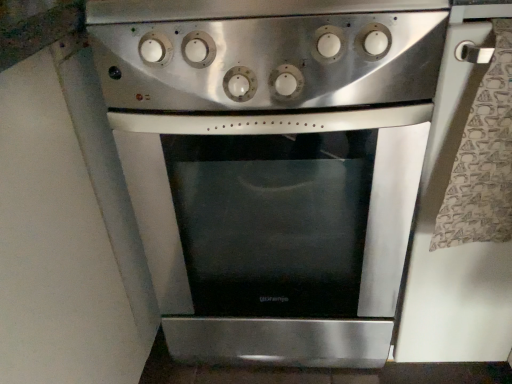
Question: From the image's perspective, is stainless steel oven at center beneath stainless steel oven at center?

Choices:
 (A) no
 (B) yes

Answer: (B)

Question: Is stainless steel oven at center far away from stainless steel oven at center?

Choices:
 (A) yes
 (B) no

Answer: (B)

Question: Is stainless steel oven at center not inside stainless steel oven at center?

Choices:
 (A) no
 (B) yes

Answer: (B)

Question: Does stainless steel oven at center have a larger size compared to stainless steel oven at center?

Choices:
 (A) no
 (B) yes

Answer: (B)

Question: Is stainless steel oven at center smaller than stainless steel oven at center?

Choices:
 (A) no
 (B) yes

Answer: (A)

Question: From the image's perspective, is stainless steel oven at center above stainless steel oven at center?

Choices:
 (A) yes
 (B) no

Answer: (B)

Question: From a real-world perspective, does stainless steel oven at center sit lower than stainless steel oven at center?

Choices:
 (A) yes
 (B) no

Answer: (B)

Question: Is the surface of stainless steel oven at center in direct contact with stainless steel oven at center?

Choices:
 (A) yes
 (B) no

Answer: (B)

Question: Is stainless steel oven at center to the right of stainless steel oven at center from the viewer's perspective?

Choices:
 (A) no
 (B) yes

Answer: (A)

Question: Can you confirm if stainless steel oven at center is shorter than stainless steel oven at center?

Choices:
 (A) no
 (B) yes

Answer: (B)

Question: Is stainless steel oven at center positioned far away from stainless steel oven at center?

Choices:
 (A) yes
 (B) no

Answer: (B)

Question: From the image's perspective, is stainless steel oven at center on stainless steel oven at center?

Choices:
 (A) no
 (B) yes

Answer: (B)

Question: Relative to stainless steel oven at center, is stainless steel oven at center in front or behind?

Choices:
 (A) behind
 (B) front

Answer: (B)